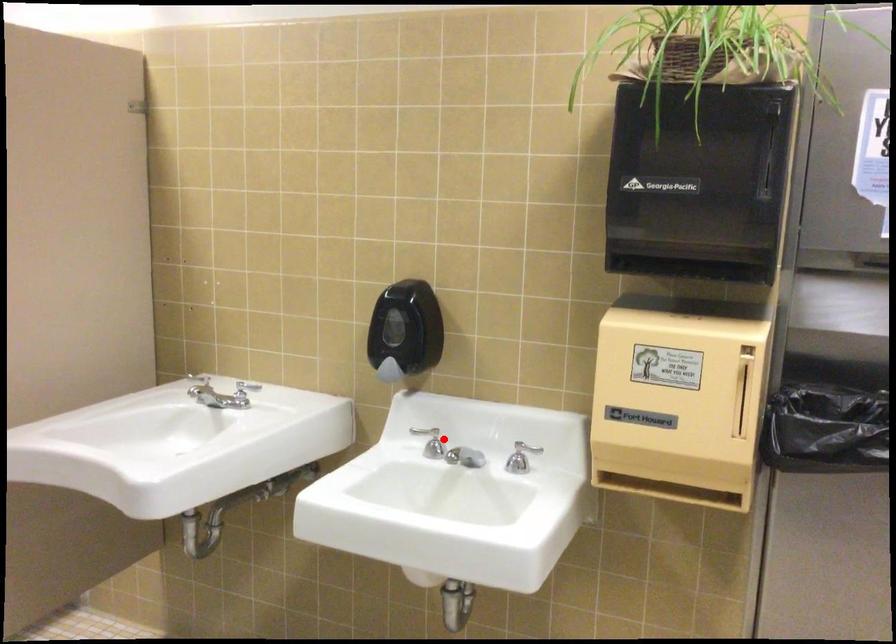
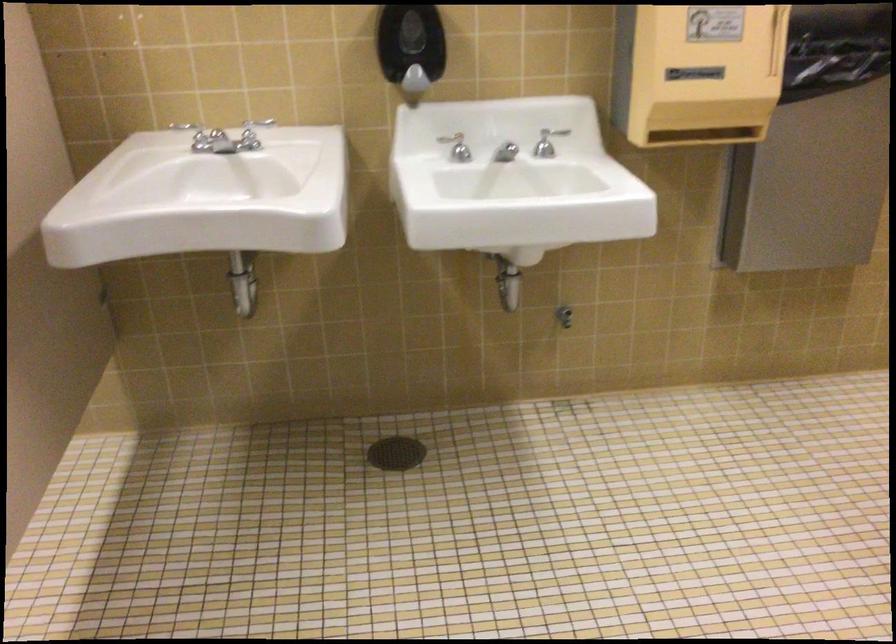
Where in the second image is the point corresponding to the highlighted location from the first image?

(457, 147)